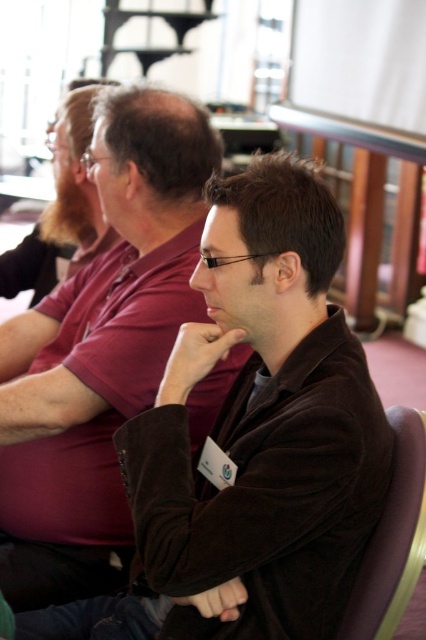
Between point (36, 340) and point (374, 563), which one is positioned in front?

Point (374, 563)

Is brown velvety shirt at center bigger than purple fabric chair at lower right?

Yes, brown velvety shirt at center is bigger than purple fabric chair at lower right.

Does point (16, 429) come farther from viewer compared to point (411, 472)?

Yes, it is.

I want to click on brown velvety shirt at center, so click(100, 349).